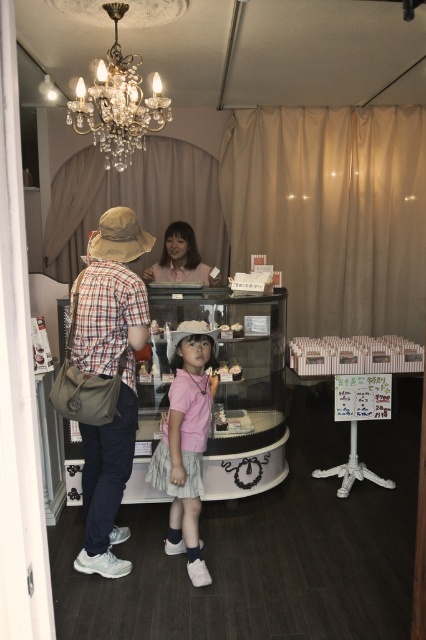
Who is more forward, (152, 109) or (186, 224)?

Point (152, 109)

At what (x,y) coordinates should I click in order to perform the action: click on crystal chandelier at upper center. Please return your answer as a coordinate pair (x, y). The height and width of the screenshot is (640, 426). Looking at the image, I should click on (118, 102).

Where is `crystal chandelier at upper center`? The image size is (426, 640). crystal chandelier at upper center is located at coordinates (118, 102).

In the scene shown: Can you confirm if matte plaid shirt at center is positioned above crystal chandelier at upper center?

No, matte plaid shirt at center is not above crystal chandelier at upper center.

Is point (112, 509) positioned in front of point (71, 104)?

Yes.

Image resolution: width=426 pixels, height=640 pixels. In order to click on matte plaid shirt at center in this screenshot , I will do `click(109, 378)`.

Is matte plaid shirt at center wider than pink cotton shirt at center?

Indeed, matte plaid shirt at center has a greater width compared to pink cotton shirt at center.

The height and width of the screenshot is (640, 426). Identify the location of matte plaid shirt at center. (109, 378).